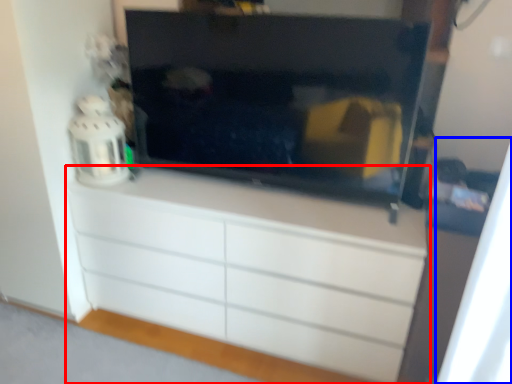
Question: Among these objects, which one is farthest to the camera, chest of drawers (highlighted by a red box) or curtain (highlighted by a blue box)?

Choices:
 (A) chest of drawers
 (B) curtain

Answer: (A)